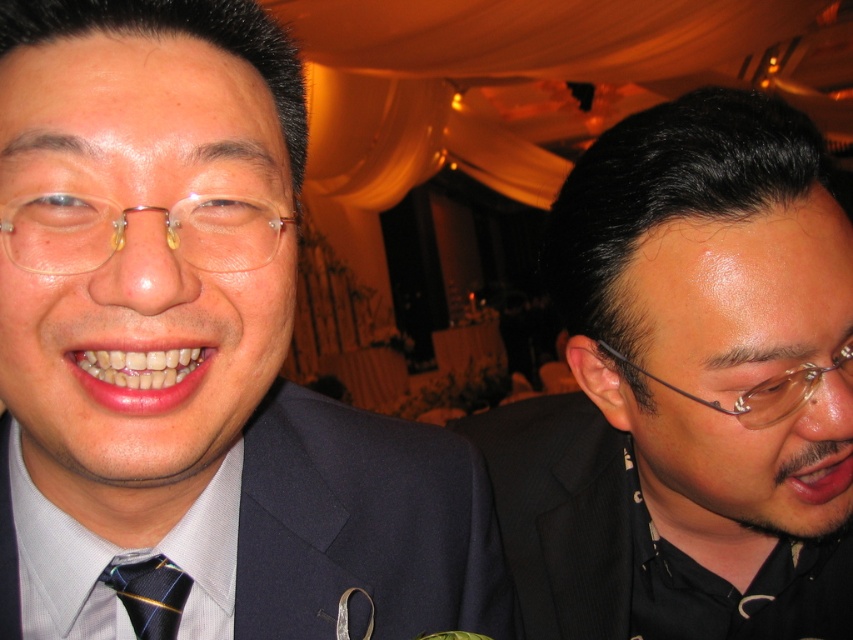
Question: Can you confirm if black matte suit at right is positioned below transparent plastic glasses at right?

Choices:
 (A) no
 (B) yes

Answer: (B)

Question: Which point appears closest to the camera in this image?

Choices:
 (A) (9, 108)
 (B) (598, 320)
 (C) (125, 240)
 (D) (476, 476)

Answer: (C)

Question: Is striped silk tie at left further to the viewer compared to transparent plastic glasses at right?

Choices:
 (A) no
 (B) yes

Answer: (A)

Question: Which object is closer to the camera taking this photo?

Choices:
 (A) transparent plastic glasses at right
 (B) black pinstripe suit at right
 (C) striped silk tie at left
 (D) matte black suit at center

Answer: (D)

Question: Considering the relative positions of dark blue fabric suit at center and transparent plastic glasses at right in the image provided, where is dark blue fabric suit at center located with respect to transparent plastic glasses at right?

Choices:
 (A) below
 (B) above

Answer: (A)

Question: Considering the real-world distances, which object is closest to the transparent plastic glasses at right?

Choices:
 (A) black pinstripe suit at right
 (B) black matte suit at right

Answer: (B)